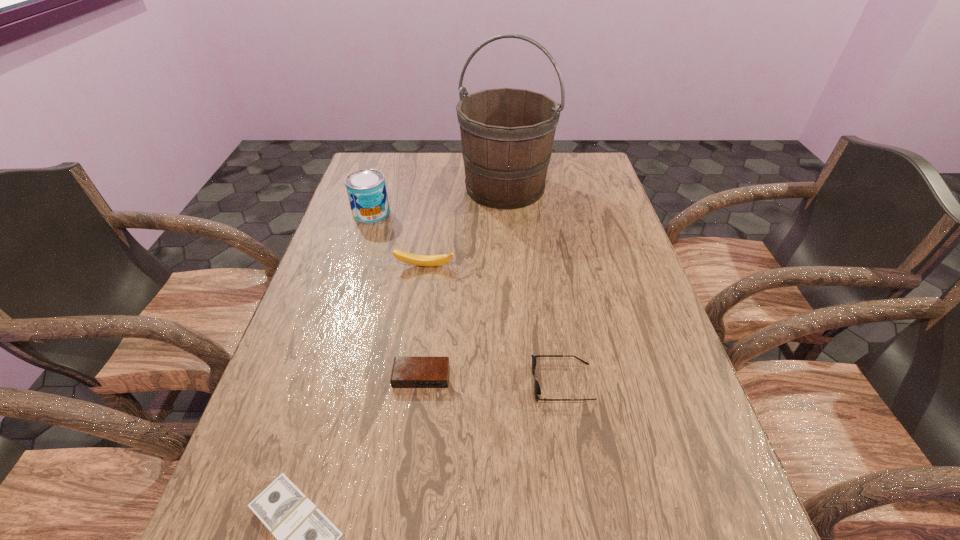
Where is `free spot between the bucket and the second shortest object`? The width and height of the screenshot is (960, 540). free spot between the bucket and the second shortest object is located at coordinates (463, 282).

Find the location of a particular element. vacant space in between the can and the alarm clock is located at coordinates (396, 295).

What are the coordinates of `vacant space that is in between the fourth nearest object and the second shortest object` in the screenshot? It's located at (423, 321).

Where is `free space that is in between the fourth nearest object and the sunglasses`? The image size is (960, 540). free space that is in between the fourth nearest object and the sunglasses is located at coordinates (493, 325).

This screenshot has height=540, width=960. In order to click on unoccupied area between the third tallest object and the third shortest object in this screenshot , I will do `click(493, 325)`.

You are a GUI agent. You are given a task and a screenshot of the screen. Output one action in this format:
    pyautogui.click(x=<x>, y=<y>)
    Task: Click on the blank region between the fourth nearest object and the alarm clock
    The image size is (960, 540).
    Given the screenshot: What is the action you would take?
    [423, 321]

This screenshot has height=540, width=960. In order to click on vacant space that's between the fifth tallest object and the fourth nearest object in this screenshot , I will do `click(423, 321)`.

Identify the location of object identified as the second closest to the banana. Image resolution: width=960 pixels, height=540 pixels. (507, 134).

Point out which object is positioned as the nearest to the dollar. Please provide its 2D coordinates. Your answer should be formatted as a tuple, i.e. [(x, y)], where the tuple contains the x and y coordinates of a point satisfying the conditions above.

[(407, 372)]